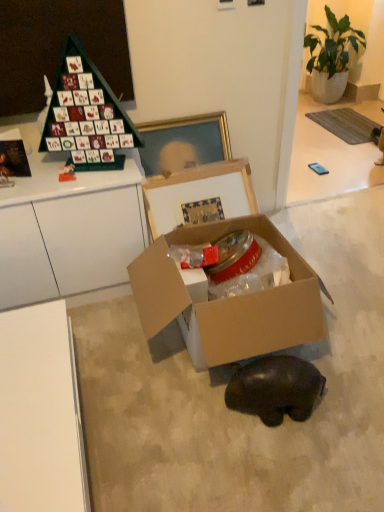
Question: Is black matte bear at lower center in front of or behind green matte advent calendar at upper left in the image?

Choices:
 (A) behind
 (B) front

Answer: (B)

Question: Based on their sizes in the image, would you say black matte bear at lower center is bigger or smaller than green matte advent calendar at upper left?

Choices:
 (A) big
 (B) small

Answer: (B)

Question: Which of these objects is positioned closest to the green leafy plant in pot at upper right?

Choices:
 (A) green matte advent calendar at upper left
 (B) black matte bear at lower center
 (C) cardboard box at center

Answer: (C)

Question: Based on their relative distances, which object is nearer to the cardboard box at center?

Choices:
 (A) green matte advent calendar at upper left
 (B) black matte bear at lower center
 (C) green leafy plant in pot at upper right

Answer: (B)